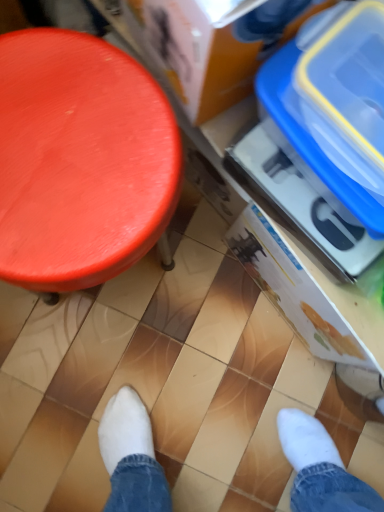
Identify the location of blue plastic storage box at upper right, the 2th storage box viewed from the back. Image resolution: width=384 pixels, height=512 pixels. (335, 104).

This screenshot has height=512, width=384. Identify the location of blue plastic storage box at upper right, the 2th storage box positioned from the front. (335, 104).

Can you tell me how much blue plastic storage box at upper right, positioned as the 1th storage box in front-to-back order, and blue plastic storage box at right, which is the 1th storage box from back to front, differ in facing direction?

There is a 89.7-degree angle between the facing directions of blue plastic storage box at upper right, positioned as the 1th storage box in front-to-back order, and blue plastic storage box at right, which is the 1th storage box from back to front.

Could you tell me if blue plastic storage box at upper right, the third storage box viewed from the back, is facing blue plastic storage box at right, which is the 1th storage box from back to front?

No.

Consider the image. In terms of size, does blue plastic storage box at upper right, the third storage box viewed from the back, appear bigger or smaller than blue plastic storage box at right, the third storage box viewed from the front?

In the image, blue plastic storage box at upper right, the third storage box viewed from the back, appears to be smaller than blue plastic storage box at right, the third storage box viewed from the front.

Looking at this image, is blue plastic storage box at upper right, the third storage box viewed from the back, far away from blue plastic storage box at right, which is the 1th storage box from back to front?

No, blue plastic storage box at upper right, the third storage box viewed from the back, is not far away from blue plastic storage box at right, which is the 1th storage box from back to front.

In the image, is blue plastic storage box at upper right, positioned as the 1th storage box in front-to-back order, on the left side or the right side of blue plastic storage box at upper right, the 2th storage box viewed from the back?

In the image, blue plastic storage box at upper right, positioned as the 1th storage box in front-to-back order, appears on the left side of blue plastic storage box at upper right, the 2th storage box viewed from the back.

Does blue plastic storage box at upper right, the third storage box viewed from the back, have a smaller size compared to blue plastic storage box at upper right, the 2th storage box positioned from the front?

Actually, blue plastic storage box at upper right, the third storage box viewed from the back, might be larger than blue plastic storage box at upper right, the 2th storage box positioned from the front.

Is point (187, 71) more distant than point (311, 145)?

Yes, point (187, 71) is farther from viewer.

Could you tell me if blue plastic storage box at right, which is the 1th storage box from back to front, is facing blue plastic storage box at upper right, the 2th storage box viewed from the back?

No.

Does point (348, 333) come farther from viewer compared to point (346, 15)?

Yes, it is behind point (346, 15).

Can we say blue plastic storage box at right, the third storage box viewed from the front, lies outside blue plastic storage box at upper right, the 2th storage box positioned from the front?

blue plastic storage box at right, the third storage box viewed from the front, is positioned outside blue plastic storage box at upper right, the 2th storage box positioned from the front.

From the picture: Can you confirm if smooth orange stool at left is positioned to the right of blue plastic storage box at upper right, the 2th storage box viewed from the back?

In fact, smooth orange stool at left is to the left of blue plastic storage box at upper right, the 2th storage box viewed from the back.

Does smooth orange stool at left have a larger size compared to blue plastic storage box at upper right, the 2th storage box viewed from the back?

Yes.

Between point (27, 218) and point (376, 198), which one is positioned behind?

Positioned behind is point (27, 218).

Can you confirm if smooth orange stool at left is wider than blue plastic storage box at upper right, the 2th storage box viewed from the back?

Correct, the width of smooth orange stool at left exceeds that of blue plastic storage box at upper right, the 2th storage box viewed from the back.

From a real-world perspective, is blue plastic storage box at right, the third storage box viewed from the front, positioned above or below smooth orange stool at left?

blue plastic storage box at right, the third storage box viewed from the front, is situated lower than smooth orange stool at left in the real world.

Is blue plastic storage box at right, which is the 1th storage box from back to front, wider than smooth orange stool at left?

In fact, blue plastic storage box at right, which is the 1th storage box from back to front, might be narrower than smooth orange stool at left.

How many degrees apart are the facing directions of blue plastic storage box at right, which is the 1th storage box from back to front, and smooth orange stool at left?

The angle between the facing direction of blue plastic storage box at right, which is the 1th storage box from back to front, and the facing direction of smooth orange stool at left is 118 degrees.

Considering the sizes of objects blue plastic storage box at right, which is the 1th storage box from back to front, and smooth orange stool at left in the image provided, who is shorter, blue plastic storage box at right, which is the 1th storage box from back to front, or smooth orange stool at left?

blue plastic storage box at right, which is the 1th storage box from back to front, is shorter.

Where is `the 1st storage box in front of the blue plastic storage box at right, the third storage box viewed from the front`? The image size is (384, 512). the 1st storage box in front of the blue plastic storage box at right, the third storage box viewed from the front is located at coordinates (335, 104).

Which object is further away from the camera taking this photo, blue plastic storage box at upper right, the 2th storage box viewed from the back, or blue plastic storage box at right, which is the 1th storage box from back to front?

blue plastic storage box at right, which is the 1th storage box from back to front, is further away from the camera.

Looking at this image, between blue plastic storage box at upper right, the 2th storage box viewed from the back, and blue plastic storage box at right, the third storage box viewed from the front, which one has smaller size?

blue plastic storage box at upper right, the 2th storage box viewed from the back.

Which point is more distant from viewer, (353,145) or (246,233)?

Point (246,233)

Is blue plastic storage box at upper right, the 2th storage box viewed from the back, turned away from smooth orange stool at left?

No, smooth orange stool at left is not at the back of blue plastic storage box at upper right, the 2th storage box viewed from the back.

Considering the relative positions of blue plastic storage box at upper right, the 2th storage box positioned from the front, and smooth orange stool at left in the image provided, is blue plastic storage box at upper right, the 2th storage box positioned from the front, in front of smooth orange stool at left?

Yes, it is in front of smooth orange stool at left.

Does blue plastic storage box at upper right, the 2th storage box viewed from the back, have a lesser height compared to smooth orange stool at left?

Yes.

You are a GUI agent. You are given a task and a screenshot of the screen. Output one action in this format:
    pyautogui.click(x=<x>, y=<y>)
    Task: Click on the storage box that is the 1st one when counting upward from the smooth orange stool at left (from the image's perspective)
    The height and width of the screenshot is (512, 384).
    Given the screenshot: What is the action you would take?
    pyautogui.click(x=335, y=104)

The image size is (384, 512). Identify the location of storage box that is the 2nd one when counting upward from the blue plastic storage box at right, the third storage box viewed from the front (from the image's perspective). pos(195,54).

The width and height of the screenshot is (384, 512). What are the coordinates of `the 1st storage box below the blue plastic storage box at upper right, the 2th storage box positioned from the front (from a real-world perspective)` in the screenshot? It's located at (195, 54).

From the image, which object appears to be nearer to blue plastic storage box at right, the third storage box viewed from the front, blue plastic storage box at upper right, the 2th storage box positioned from the front, or blue plastic storage box at upper right, the third storage box viewed from the back?

blue plastic storage box at upper right, the 2th storage box positioned from the front, is closer to blue plastic storage box at right, the third storage box viewed from the front.

Based on the photo, estimate the real-world distances between objects in this image. Which object is further from blue plastic storage box at upper right, the 2th storage box positioned from the front, blue plastic storage box at upper right, positioned as the 1th storage box in front-to-back order, or blue plastic storage box at right, which is the 1th storage box from back to front?

Based on the image, blue plastic storage box at right, which is the 1th storage box from back to front, appears to be further to blue plastic storage box at upper right, the 2th storage box positioned from the front.

Considering their positions, is blue plastic storage box at upper right, the 2th storage box positioned from the front, positioned closer to blue plastic storage box at upper right, the third storage box viewed from the back, than blue plastic storage box at right, the third storage box viewed from the front?

blue plastic storage box at upper right, the 2th storage box positioned from the front.

Based on their spatial positions, is blue plastic storage box at upper right, the third storage box viewed from the back, or blue plastic storage box at upper right, the 2th storage box positioned from the front, further from blue plastic storage box at right, which is the 1th storage box from back to front?

Among the two, blue plastic storage box at upper right, the third storage box viewed from the back, is located further to blue plastic storage box at right, which is the 1th storage box from back to front.

Based on their spatial positions, is smooth orange stool at left or blue plastic storage box at upper right, the 2th storage box viewed from the back, closer to blue plastic storage box at right, the third storage box viewed from the front?

Among the two, blue plastic storage box at upper right, the 2th storage box viewed from the back, is located nearer to blue plastic storage box at right, the third storage box viewed from the front.

Considering their positions, is blue plastic storage box at upper right, the 2th storage box positioned from the front, positioned closer to smooth orange stool at left than blue plastic storage box at upper right, the third storage box viewed from the back?

Based on the image, blue plastic storage box at upper right, the third storage box viewed from the back, appears to be nearer to smooth orange stool at left.

Looking at this image, when comparing their distances from smooth orange stool at left, does blue plastic storage box at right, the third storage box viewed from the front, or blue plastic storage box at upper right, the 2th storage box viewed from the back, seem further?

blue plastic storage box at right, the third storage box viewed from the front, lies further to smooth orange stool at left than the other object.

From the image, which object appears to be nearer to blue plastic storage box at upper right, the 2th storage box positioned from the front, smooth orange stool at left or blue plastic storage box at upper right, the third storage box viewed from the back?

Based on the image, blue plastic storage box at upper right, the third storage box viewed from the back, appears to be nearer to blue plastic storage box at upper right, the 2th storage box positioned from the front.

Find the location of `storage box between smooth orange stool at left and blue plastic storage box at upper right, the 2th storage box viewed from the back`. storage box between smooth orange stool at left and blue plastic storage box at upper right, the 2th storage box viewed from the back is located at coordinates (195, 54).

Locate an element on the screen. storage box between blue plastic storage box at upper right, positioned as the 1th storage box in front-to-back order, and blue plastic storage box at right, which is the 1th storage box from back to front, from top to bottom is located at coordinates (335, 104).